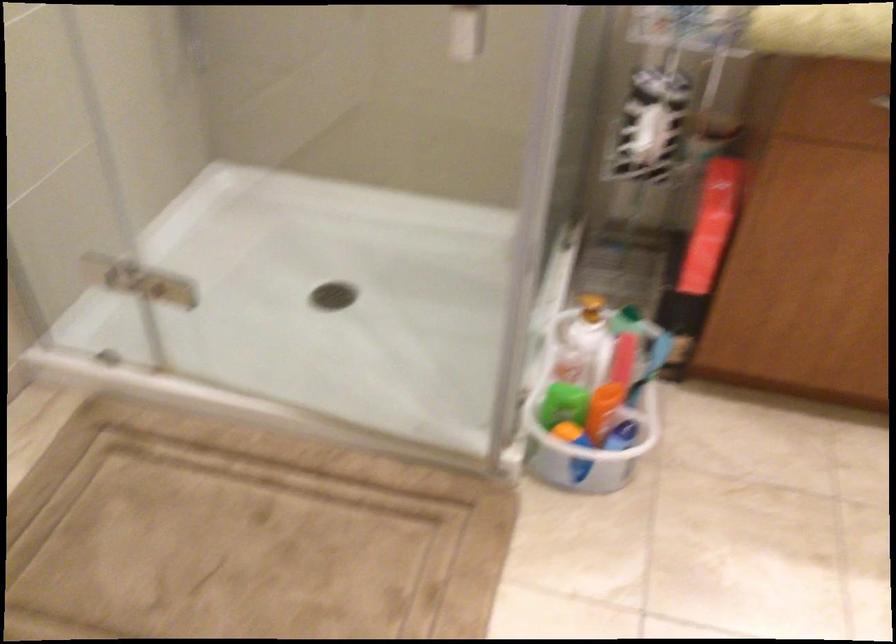
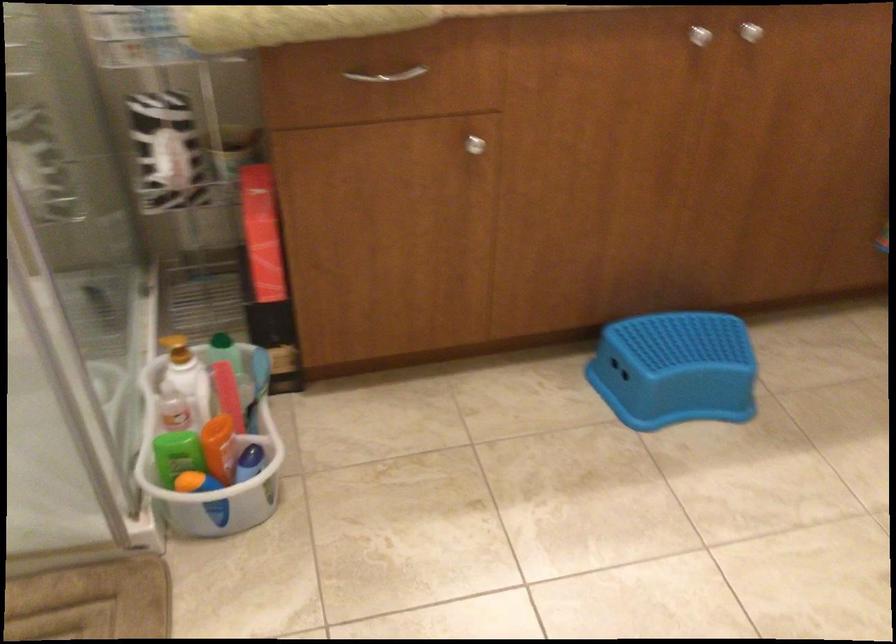
Find the pixel in the second image that matches (x=700, y=252) in the first image.

(264, 263)